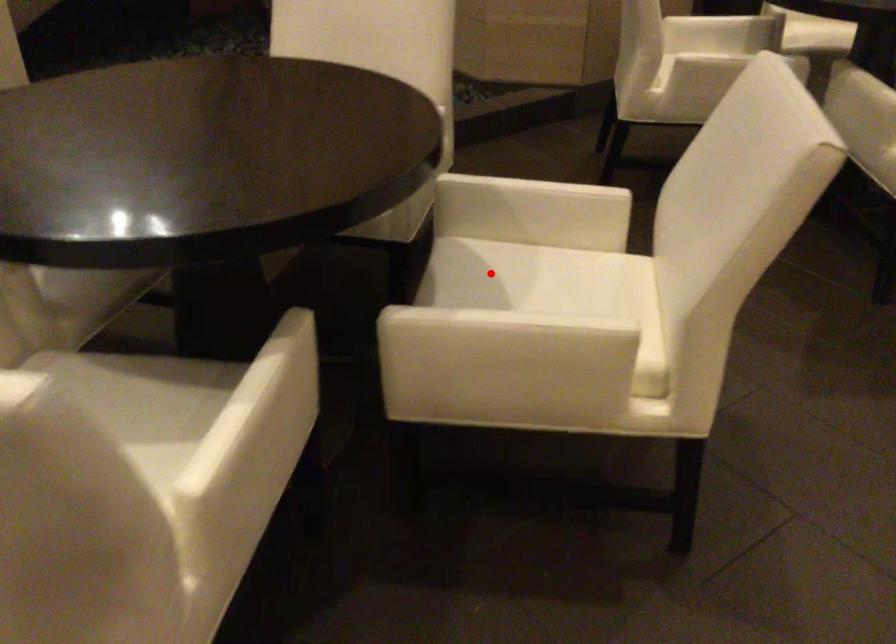
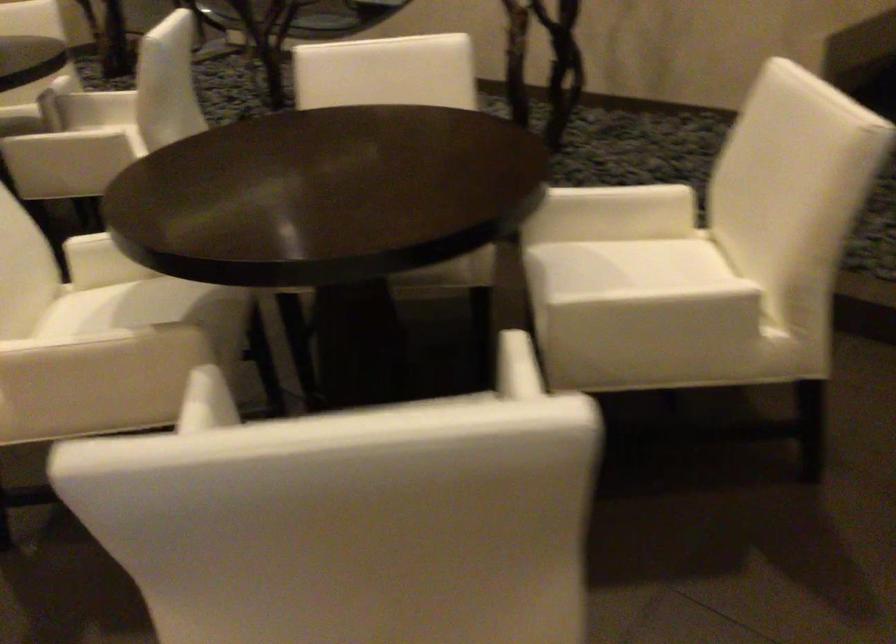
Question: I am providing you with two images of the same scene from different viewpoints. A red point is marked on the first image. At the location where the point appears in image 1, is it still visible in image 2?

Choices:
 (A) Yes
 (B) No

Answer: (B)